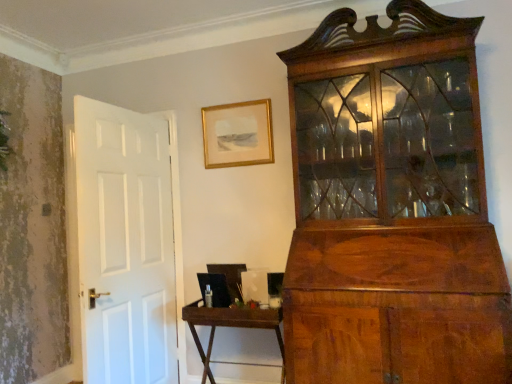
Question: From a real-world perspective, is brown wooden table at center physically located above or below gold/glass picture frame at upper center?

Choices:
 (A) above
 (B) below

Answer: (B)

Question: Does point (206, 375) appear closer or farther from the camera than point (204, 155)?

Choices:
 (A) closer
 (B) farther

Answer: (A)

Question: From their relative heights in the image, would you say brown wooden table at center is taller or shorter than gold/glass picture frame at upper center?

Choices:
 (A) tall
 (B) short

Answer: (A)

Question: Is gold/glass picture frame at upper center in front of or behind brown wooden table at center in the image?

Choices:
 (A) front
 (B) behind

Answer: (B)

Question: Looking at their shapes, would you say gold/glass picture frame at upper center is wider or thinner than brown wooden table at center?

Choices:
 (A) thin
 (B) wide

Answer: (A)

Question: Which is correct: gold/glass picture frame at upper center is inside brown wooden table at center, or outside of it?

Choices:
 (A) inside
 (B) outside

Answer: (B)

Question: Is gold/glass picture frame at upper center bigger or smaller than brown wooden table at center?

Choices:
 (A) big
 (B) small

Answer: (B)